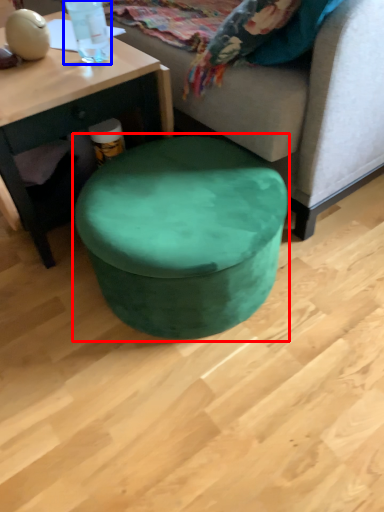
Question: Which of the following is the closest to the observer, music stool (highlighted by a red box) or bottle (highlighted by a blue box)?

Choices:
 (A) music stool
 (B) bottle

Answer: (A)